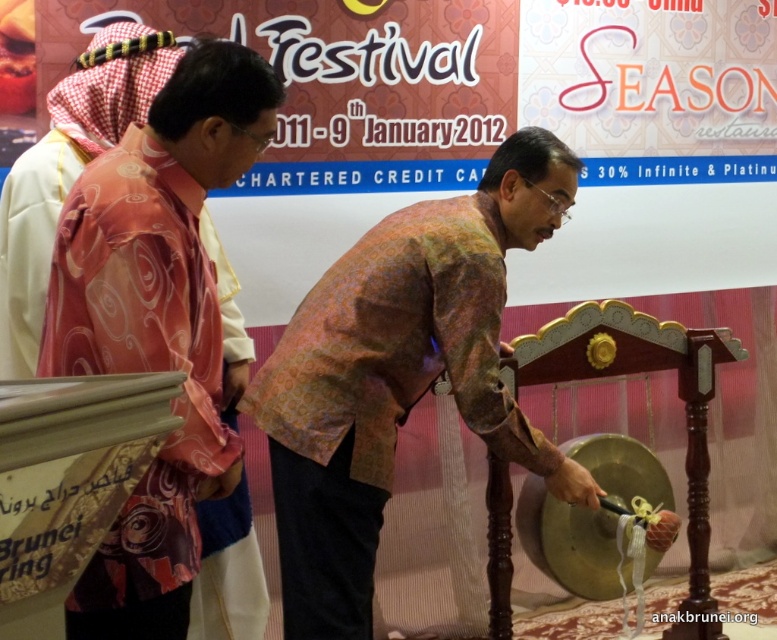
You are attending the Festival and want to take a photo with the two men in traditional attire. The multicolored batik shirt at center and the pink satin robe at left are both in your viewfinder. Which clothing item is wider in the image?

The multicolored batik shirt at center might be wider than the pink satin robe at left according to the description.

You are attending the Festival and notice two traditional garments. Which one is positioned to the right of the other? The multicolored batik shirt at center and the pink satin robe at left are both present. Could you identify which is on the right side?

The multicolored batik shirt at center is positioned to the right of the pink satin robe at left according to the description.

What is the 2D coordinate of the multicolored batik shirt at center in the image?

The multicolored batik shirt at center is located at the 2D coordinate point of (x=399, y=374).